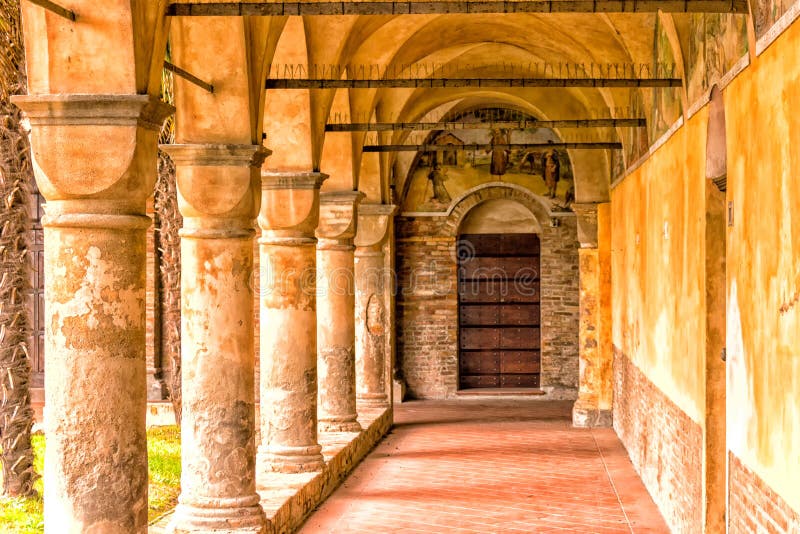
Locate an element on the screen. The image size is (800, 534). cement wall is located at coordinates (650, 324).